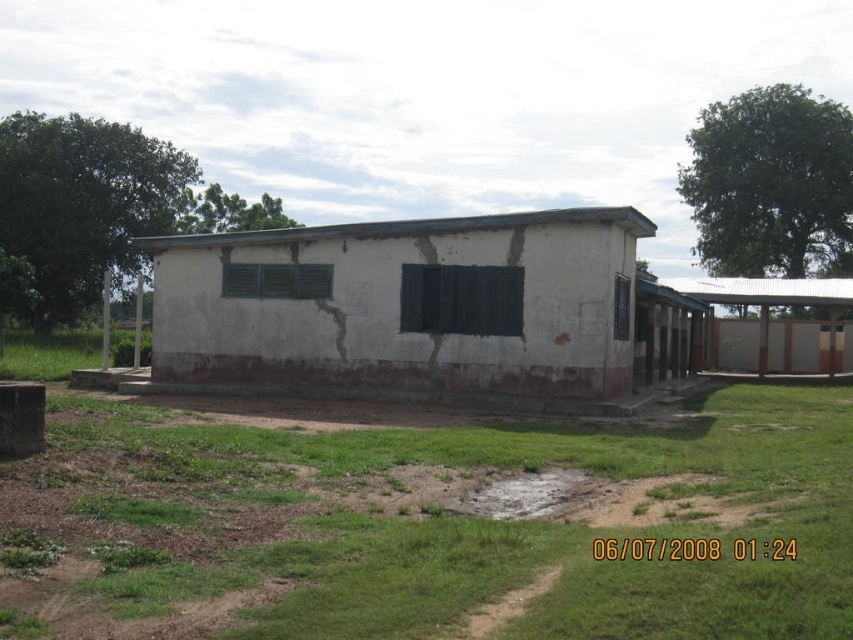
Does green grass at lower center have a lesser height compared to white matte building at center?

Correct, green grass at lower center is not as tall as white matte building at center.

Which is more to the right, green grass at lower center or white matte building at center?

green grass at lower center is more to the right.

At what (x,y) coordinates should I click in order to perform the action: click on green grass at lower center. Please return your answer as a coordinate pair (x, y). This screenshot has height=640, width=853. Looking at the image, I should click on (427, 525).

Between white matte building at center and metal corrugated roof at right, which one is positioned higher?

metal corrugated roof at right

Is point (416, 269) closer to camera compared to point (708, 298)?

Yes, it is in front of point (708, 298).

Is point (329, 364) positioned before point (764, 292)?

Yes, it is.

Identify the location of white matte building at center. (404, 308).

Is point (256, 529) closer to viewer compared to point (833, 314)?

Yes, it is.

Does green grass at lower center have a greater height compared to metal corrugated roof at right?

Incorrect, green grass at lower center's height is not larger of metal corrugated roof at right's.

The height and width of the screenshot is (640, 853). In order to click on green grass at lower center in this screenshot , I will do `click(427, 525)`.